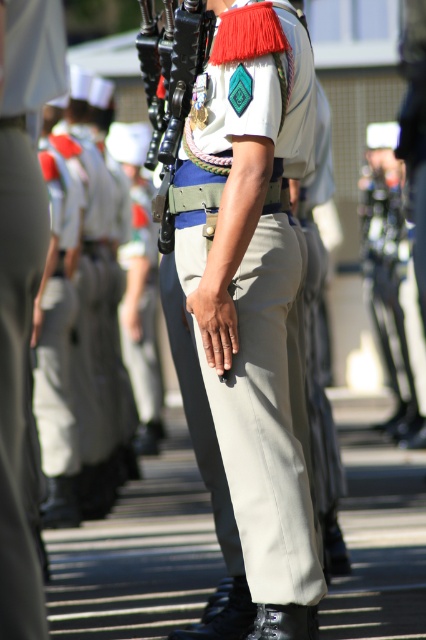
Question: Does white matte uniform at center appear on the left side of white cotton pants at left?

Choices:
 (A) yes
 (B) no

Answer: (B)

Question: Does matte khaki pants at center appear under white cotton pants at left?

Choices:
 (A) no
 (B) yes

Answer: (B)

Question: Which point is farther to the camera?

Choices:
 (A) white cotton pants at left
 (B) matte khaki pants at center
 (C) matte black rifle at center

Answer: (C)

Question: Can you confirm if white cotton pants at left is smaller than matte black rifle at center?

Choices:
 (A) yes
 (B) no

Answer: (A)

Question: Which of the following is the farthest from the observer?

Choices:
 (A) white matte uniform at center
 (B) white cotton pants at left
 (C) matte black rifle at center

Answer: (C)

Question: Which object is positioned farthest from the white matte uniform at center?

Choices:
 (A) white cotton pants at left
 (B) matte khaki pants at center

Answer: (A)